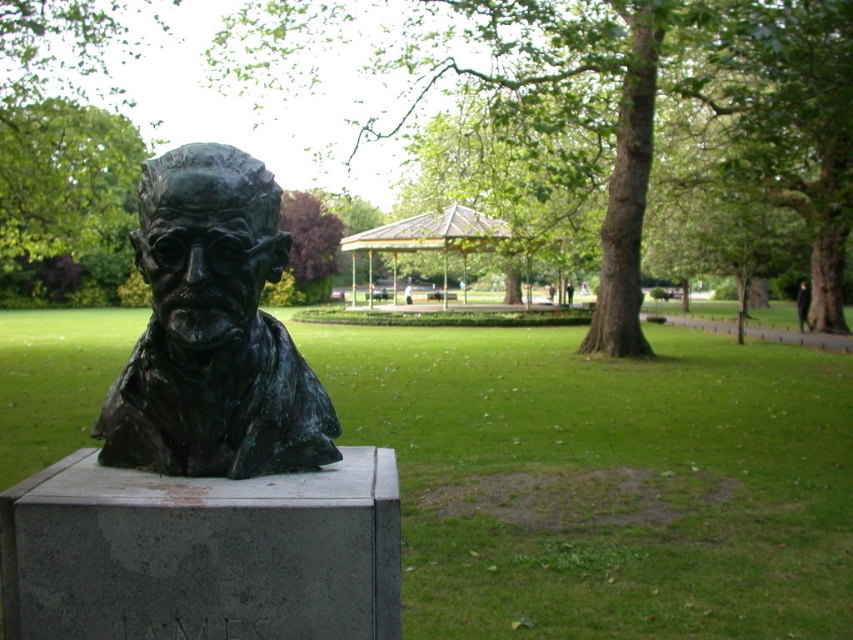
Can you confirm if green leafy tree at center is positioned above metallic gazebo at center?

No.

Is point (764, 76) farther from viewer compared to point (369, 284)?

No, it is in front of (369, 284).

You are a GUI agent. You are given a task and a screenshot of the screen. Output one action in this format:
    pyautogui.click(x=<x>, y=<y>)
    Task: Click on the green leafy tree at center
    Image resolution: width=853 pixels, height=640 pixels.
    Given the screenshot: What is the action you would take?
    pyautogui.click(x=654, y=108)

Is point (122, 397) positioned before point (354, 252)?

Yes, it is.

Between green patina bronze bust at center and metallic gazebo at center, which one has less height?

metallic gazebo at center is shorter.

Does point (242, 202) lie behind point (444, 276)?

That is False.

Where is `green patina bronze bust at center`? Image resolution: width=853 pixels, height=640 pixels. green patina bronze bust at center is located at coordinates (213, 332).

Consider the image. Who is positioned more to the right, bronze statue at center or green patina bronze bust at center?

Positioned to the right is bronze statue at center.

Is bronze statue at center positioned behind green patina bronze bust at center?

Yes.

What do you see at coordinates (605, 481) in the screenshot? I see `bronze statue at center` at bounding box center [605, 481].

What are the coordinates of `bronze statue at center` in the screenshot? It's located at (605, 481).